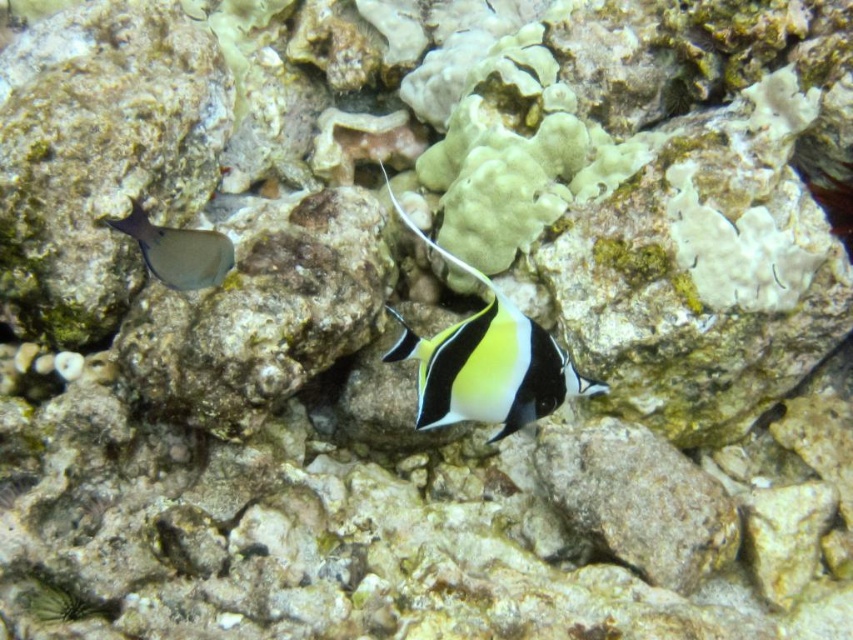
You are a marine biologist observing an underwater scene. There is a point labeled at coordinates point (486, 362). What object is located at this point?

The point (486, 362) marks the black glossy fish at center.

You are a marine biologist observing an underwater scene. You notice two fish in the image. The black glossy fish at center and the smooth gray fish at left. Which fish has a greater height?

The black glossy fish at center is much taller than the smooth gray fish at left.

You are a marine biologist observing an underwater scene. You need to locate the black glossy fish at center. What are its coordinates in the image?

The black glossy fish at center is located at coordinates point (x=486, y=362).